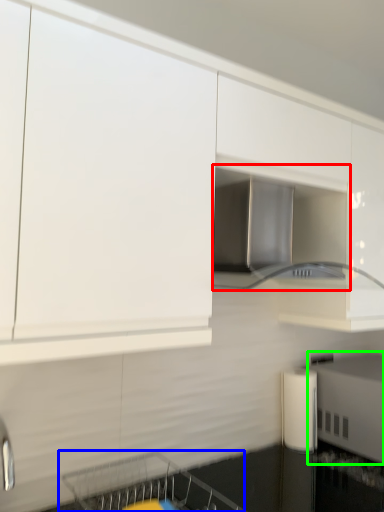
Question: Which is nearer to the home appliance (highlighted by a red box)? dish washer (highlighted by a blue box) or appliance (highlighted by a green box).

Choices:
 (A) dish washer
 (B) appliance

Answer: (B)